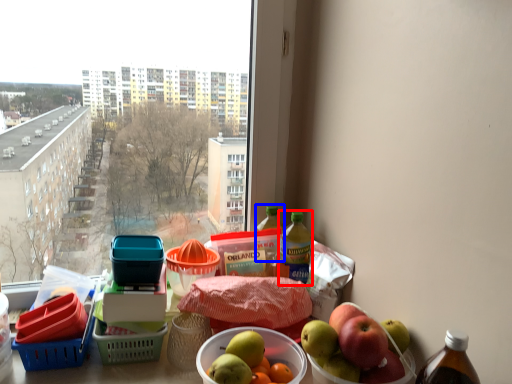
Question: Among these objects, which one is farthest to the camera, bottle (highlighted by a red box) or bottle (highlighted by a blue box)?

Choices:
 (A) bottle
 (B) bottle

Answer: (B)